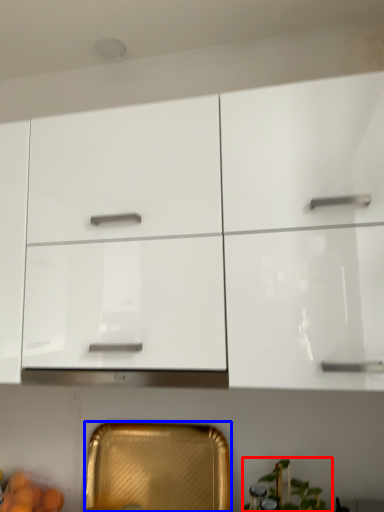
Question: Which point is further to the camera, plant (highlighted by a red box) or cabinetry (highlighted by a blue box)?

Choices:
 (A) plant
 (B) cabinetry

Answer: (B)